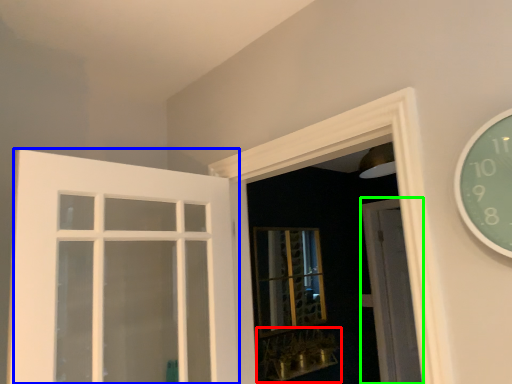
Question: Which is farther away from window sill (highlighted by a red box)? door (highlighted by a blue box) or door (highlighted by a green box)?

Choices:
 (A) door
 (B) door

Answer: (A)